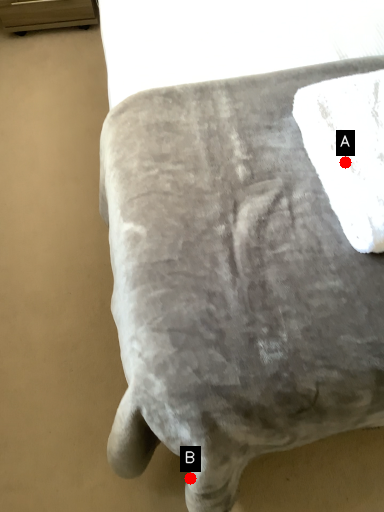
Question: Two points are circled on the image, labeled by A and B beside each circle. Which point is farther to the camera?

Choices:
 (A) A is further
 (B) B is further

Answer: (A)